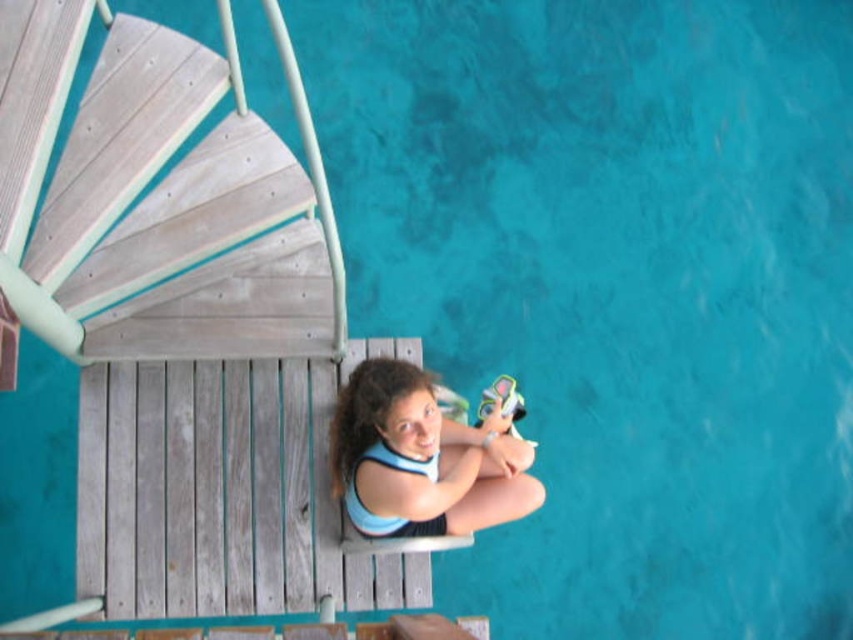
Question: Which point is farther to the camera?

Choices:
 (A) blue fabric girl at center
 (B) light gray wood stairs at upper left

Answer: (A)

Question: Can you confirm if light gray wood stairs at upper left is thinner than blue fabric girl at center?

Choices:
 (A) no
 (B) yes

Answer: (A)

Question: Among these points, which one is farthest from the camera?

Choices:
 (A) (177, 100)
 (B) (527, 483)

Answer: (B)

Question: Can you confirm if light gray wood stairs at upper left is positioned to the left of blue fabric girl at center?

Choices:
 (A) yes
 (B) no

Answer: (A)

Question: Can you confirm if light gray wood stairs at upper left is thinner than blue fabric girl at center?

Choices:
 (A) no
 (B) yes

Answer: (A)

Question: Which of the following is the closest to the observer?

Choices:
 (A) light gray wood stairs at upper left
 (B) blue fabric girl at center

Answer: (A)